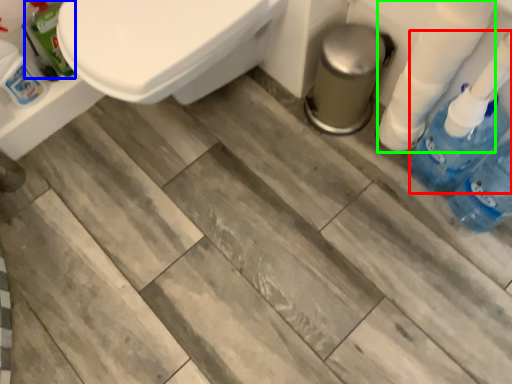
Question: Considering the real-world distances, which object is farthest from cleaning product (highlighted by a red box)? cleaning product (highlighted by a blue box) or toilet paper (highlighted by a green box)?

Choices:
 (A) cleaning product
 (B) toilet paper

Answer: (A)